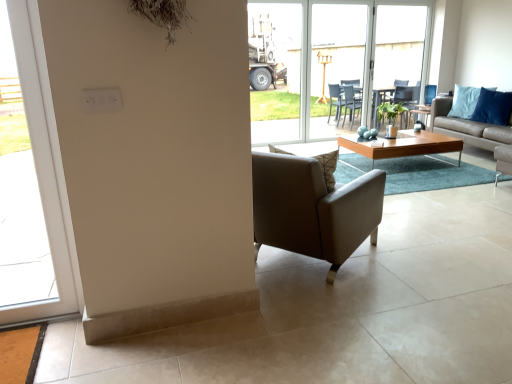
Question: Is point (284, 13) closer or farther from the camera than point (499, 107)?

Choices:
 (A) farther
 (B) closer

Answer: (B)

Question: Is transparent glass door at center, the 2th window from the bottom, in front of or behind blue fabric pillow at upper right in the image?

Choices:
 (A) behind
 (B) front

Answer: (A)

Question: Considering the real-world distances, which object is closest to the green matte plant at center?

Choices:
 (A) blue fabric pillow at upper right
 (B) transparent plastic screen door at center, which is the second screen door in right-to-left order
 (C) light brown leather couch at center right
 (D) leather at center
 (E) white glass window at left, which appears as the second window when viewed from the top

Answer: (B)

Question: Which object is the closest to the white glass window at left, marked as the first window in a front-to-back arrangement?

Choices:
 (A) transparent glass door at center, the 1th window from the right
 (B) light brown leather couch at center right
 (C) light brown wooden coffee table at center
 (D) transparent glass screen door at center, marked as the first screen door in a right-to-left arrangement
 (E) blue fabric pillow at upper right

Answer: (C)